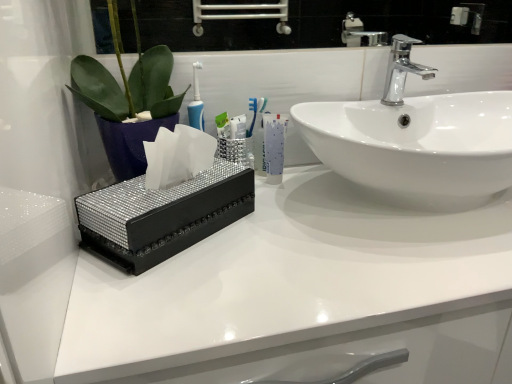
Where is `vacant space to the right of sparkly black tissue box at center`? This screenshot has width=512, height=384. vacant space to the right of sparkly black tissue box at center is located at coordinates (287, 231).